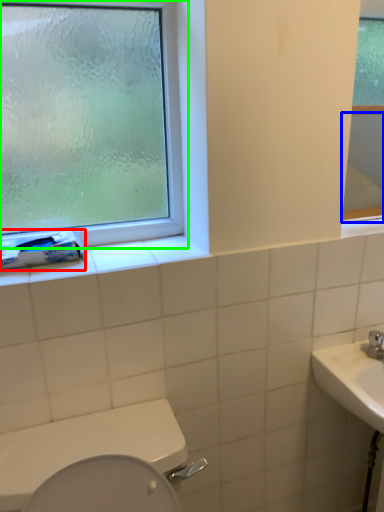
Question: Based on their relative distances, which object is farther from toilet paper (highlighted by a red box)? Choose from mirror (highlighted by a blue box) and window (highlighted by a green box).

Choices:
 (A) mirror
 (B) window

Answer: (A)